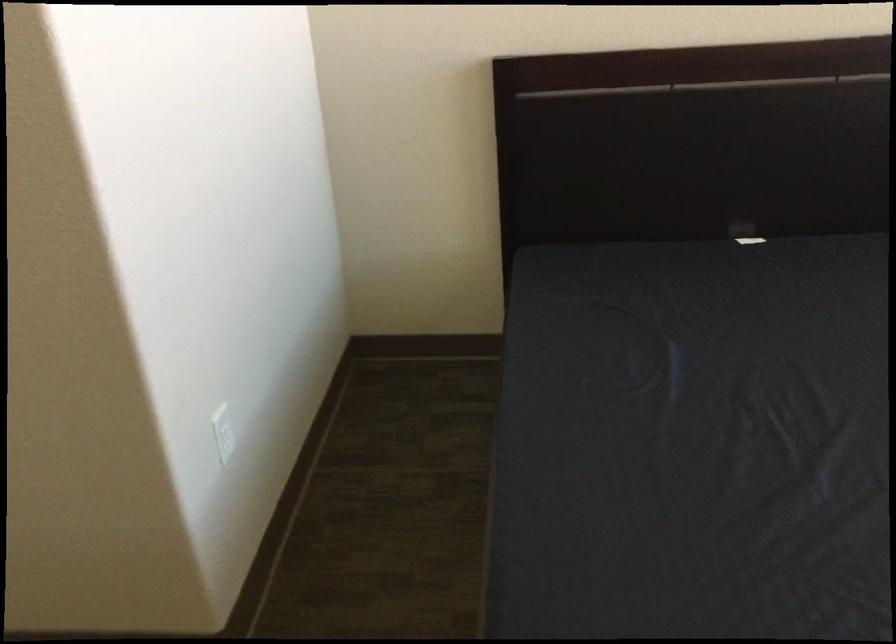
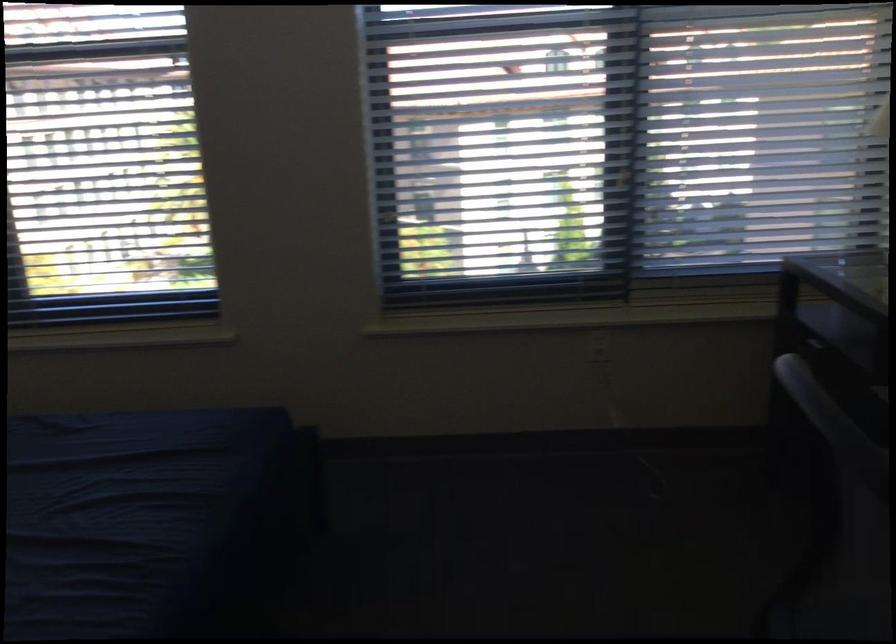
Question: The images are taken continuously from a first-person perspective. In which direction is your viewpoint rotating?

Choices:
 (A) Left
 (B) Right
 (C) Up
 (D) Down

Answer: (B)